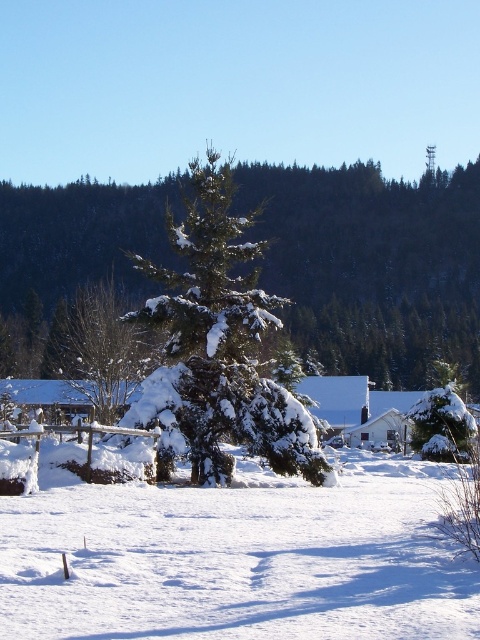
Question: Is green textured pine tree at center thinner than snow-covered evergreen tree at center?

Choices:
 (A) yes
 (B) no

Answer: (A)

Question: Is the position of white fluffy snow at center less distant than that of snow-covered evergreen at center?

Choices:
 (A) yes
 (B) no

Answer: (A)

Question: Which of these objects is positioned closest to the snow-covered evergreen at center?

Choices:
 (A) snow-covered evergreen tree at center
 (B) white fluffy snow at center
 (C) white matte house at center

Answer: (A)

Question: Which object appears closest to the camera in this image?

Choices:
 (A) white fluffy snow at center
 (B) snow-covered evergreen at center
 (C) snow-covered evergreen tree at center

Answer: (A)

Question: Is green textured pine tree at center thinner than white matte house at center?

Choices:
 (A) yes
 (B) no

Answer: (B)

Question: Which point is farther to the camera?

Choices:
 (A) (269, 408)
 (B) (384, 413)
 (C) (148, 637)

Answer: (B)